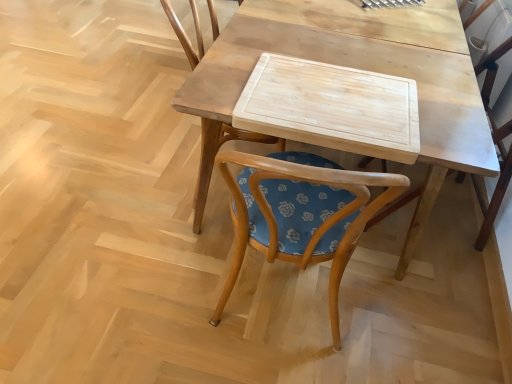
Question: From the image's perspective, is wooden chair at center, arranged as the 1th chair when viewed from the right, located above or below wooden chair at center, which is counted as the first chair, starting from the left?

Choices:
 (A) above
 (B) below

Answer: (B)

Question: Looking at the image, does wooden chair at center, arranged as the 1th chair when viewed from the right, seem bigger or smaller compared to wooden chair at center, which is counted as the first chair, starting from the left?

Choices:
 (A) big
 (B) small

Answer: (B)

Question: Which object is the farthest from the wooden chair at center, positioned as the 2th chair in left-to-right order?

Choices:
 (A) natural wood cutting board at center
 (B) wooden cutting board at center
 (C) wooden chair at center, which is counted as the first chair, starting from the left

Answer: (C)

Question: Which object is positioned closest to the natural wood cutting board at center?

Choices:
 (A) wooden cutting board at center
 (B) wooden chair at center, positioned as the 2th chair in left-to-right order
 (C) wooden chair at center, which is counted as the first chair, starting from the left

Answer: (A)